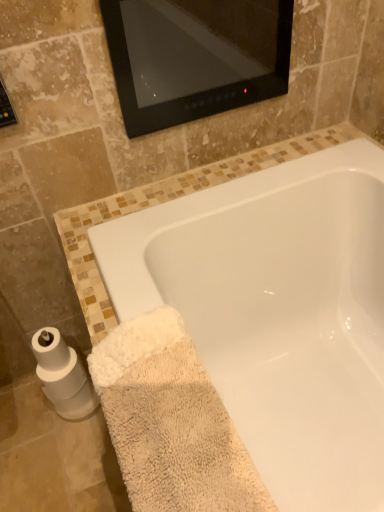
Question: Is white matte toilet paper at lower left looking in the opposite direction of beige fluffy towel at lower left?

Choices:
 (A) yes
 (B) no

Answer: (B)

Question: From the image's perspective, is white matte toilet paper at lower left below beige fluffy towel at lower left?

Choices:
 (A) yes
 (B) no

Answer: (B)

Question: Is white matte toilet paper at lower left aimed at beige fluffy towel at lower left?

Choices:
 (A) no
 (B) yes

Answer: (B)

Question: Considering the relative sizes of white matte toilet paper at lower left and beige fluffy towel at lower left in the image provided, is white matte toilet paper at lower left taller than beige fluffy towel at lower left?

Choices:
 (A) yes
 (B) no

Answer: (B)

Question: Is white matte toilet paper at lower left outside beige fluffy towel at lower left?

Choices:
 (A) no
 (B) yes

Answer: (B)

Question: Is white matte toilet paper at lower left inside the boundaries of white glossy bathtub at lower center, or outside?

Choices:
 (A) outside
 (B) inside

Answer: (A)

Question: Is point (57, 398) positioned closer to the camera than point (208, 320)?

Choices:
 (A) farther
 (B) closer

Answer: (A)

Question: From the image's perspective, relative to white glossy bathtub at lower center, is white matte toilet paper at lower left above or below?

Choices:
 (A) above
 (B) below

Answer: (B)

Question: Is white matte toilet paper at lower left wider or thinner than white glossy bathtub at lower center?

Choices:
 (A) wide
 (B) thin

Answer: (B)

Question: Do you think white matte toilet paper at lower left is within beige fluffy towel at lower left, or outside of it?

Choices:
 (A) outside
 (B) inside

Answer: (A)

Question: Visually, is white matte toilet paper at lower left positioned to the left or to the right of beige fluffy towel at lower left?

Choices:
 (A) right
 (B) left

Answer: (B)

Question: Considering the positions of white matte toilet paper at lower left and beige fluffy towel at lower left in the image, is white matte toilet paper at lower left bigger or smaller than beige fluffy towel at lower left?

Choices:
 (A) big
 (B) small

Answer: (B)

Question: Considering their positions, is white matte toilet paper at lower left located in front of or behind beige fluffy towel at lower left?

Choices:
 (A) behind
 (B) front

Answer: (A)

Question: Considering the relative positions of beige fluffy towel at lower left and white matte toilet paper at lower left in the image provided, is beige fluffy towel at lower left to the left or to the right of white matte toilet paper at lower left?

Choices:
 (A) right
 (B) left

Answer: (A)

Question: From the image's perspective, is beige fluffy towel at lower left positioned above or below white matte toilet paper at lower left?

Choices:
 (A) below
 (B) above

Answer: (A)